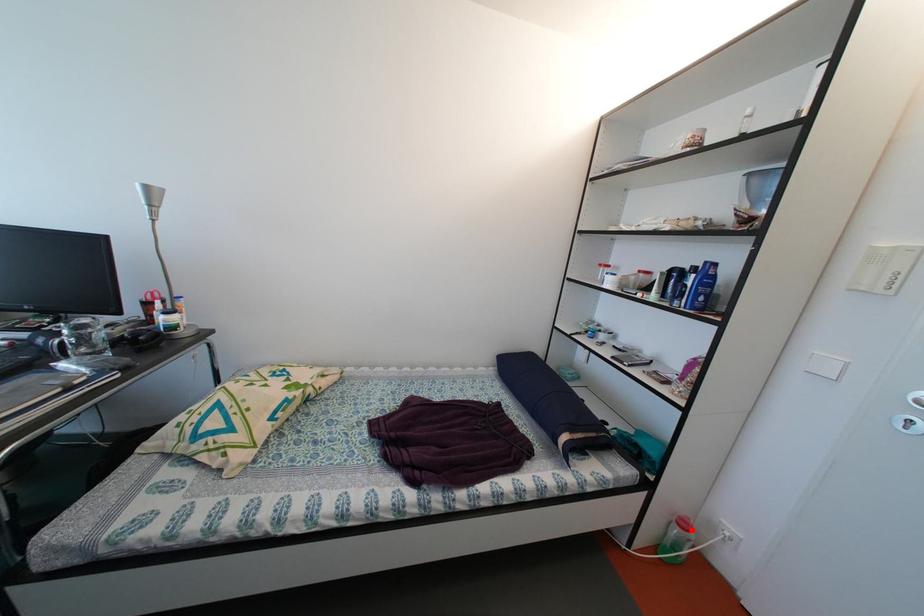
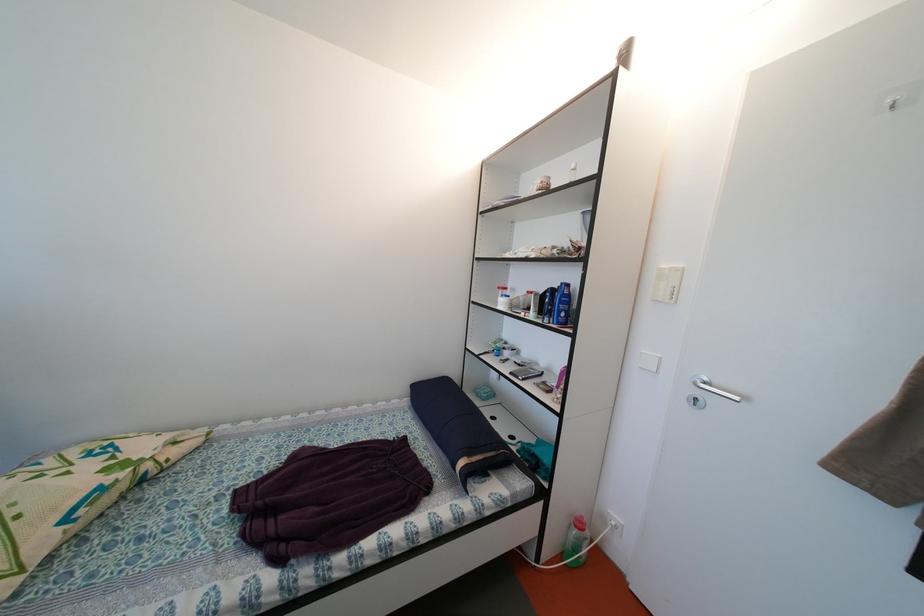
Where in the second image is the point corresponding to the highlighted location from the first image?

(587, 530)